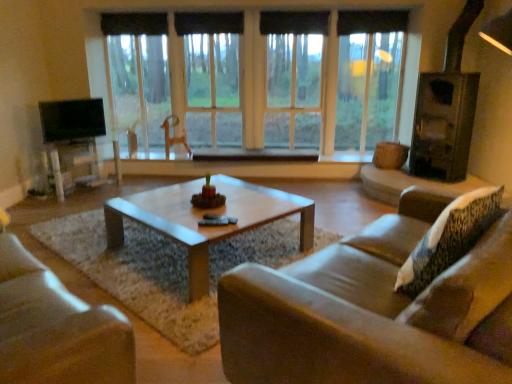
Question: Based on their sizes in the image, would you say black fabric curtain at upper center, placed as the third curtain when sorted from left to right, is bigger or smaller than matte white entertainment center at left?

Choices:
 (A) small
 (B) big

Answer: (A)

Question: Considering the relative positions of black fabric curtain at upper center, the first curtain when ordered from right to left, and matte white entertainment center at left in the image provided, is black fabric curtain at upper center, the first curtain when ordered from right to left, to the left or to the right of matte white entertainment center at left?

Choices:
 (A) left
 (B) right

Answer: (B)

Question: Estimate the real-world distances between objects in this image. Which object is farther from the transparent glass window at center?

Choices:
 (A) matte white entertainment center at left
 (B) black fabric curtain at upper center, placed as the third curtain when sorted from left to right
 (C) leather couch at lower left, placed as the second studio couch when sorted from right to left
 (D) black fabric curtain at upper center, the 2th curtain when ordered from left to right
 (E) black fabric curtain at upper center, arranged as the 1th curtain when viewed from the left

Answer: (C)

Question: Which is farther from the brown leather couch at center, positioned as the 2th studio couch in left-to-right order?

Choices:
 (A) black fabric curtain at upper center, arranged as the 1th curtain when viewed from the left
 (B) black fabric curtain at upper center, the second curtain in the right-to-left sequence
 (C) matte white entertainment center at left
 (D) black fabric curtain at upper center, the first curtain when ordered from right to left
 (E) transparent glass window at center

Answer: (A)